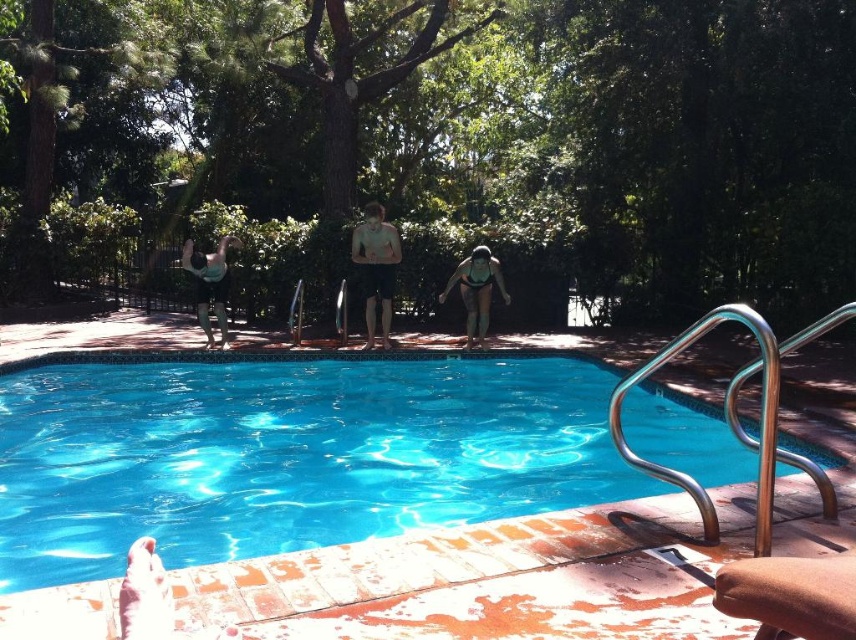
Question: Can you confirm if blue tile pool at center is positioned above matte black swimsuit at upper left?

Choices:
 (A) no
 (B) yes

Answer: (A)

Question: Which of these objects is positioned closest to the matte black bikini at center?

Choices:
 (A) blue tile pool at center
 (B) smooth skin man at center
 (C) matte black swimsuit at upper left

Answer: (B)

Question: Is smooth skin man at center to the left of matte black bikini at center from the viewer's perspective?

Choices:
 (A) yes
 (B) no

Answer: (A)

Question: Which object is closer to the camera taking this photo?

Choices:
 (A) smooth skin man at center
 (B) matte black swimsuit at upper left
 (C) matte black bikini at center
 (D) blue tile pool at center

Answer: (D)

Question: Does blue tile pool at center lie behind smooth skin man at center?

Choices:
 (A) yes
 (B) no

Answer: (B)

Question: Based on their relative distances, which object is nearer to the matte black bikini at center?

Choices:
 (A) smooth skin man at center
 (B) matte black swimsuit at upper left

Answer: (A)